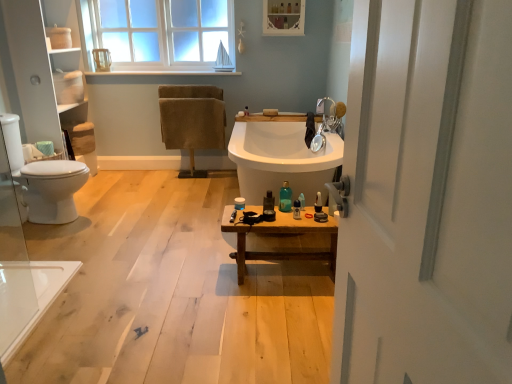
Question: Considering the positions of translucent plastic tube at center, acting as the 2th toiletry starting from the right, and translucent plastic bottle at center, which is the second toiletry from left to right, in the image, is translucent plastic tube at center, acting as the 2th toiletry starting from the right, taller or shorter than translucent plastic bottle at center, which is the second toiletry from left to right,?

Choices:
 (A) tall
 (B) short

Answer: (B)

Question: Looking at their shapes, would you say translucent plastic tube at center, acting as the 2th toiletry starting from the right, is wider or thinner than translucent plastic bottle at center, which is the second toiletry from left to right?

Choices:
 (A) thin
 (B) wide

Answer: (A)

Question: Which of these objects is positioned farthest from the silver metallic faucet at upper center?

Choices:
 (A) wooden bench at center
 (B) translucent plastic bottle at center, marked as the 4th toiletry in a left-to-right arrangement
 (C) translucent glass bottle at center, which is the fourth toiletry from right to left
 (D) white glass window at upper center
 (E) translucent plastic bottle at center, which is the second toiletry from left to right

Answer: (D)

Question: Which of these objects is positioned farthest from the white glossy toilet at left?

Choices:
 (A) matte white container at center, which appears as the first toiletry when viewed from the left
 (B) translucent glass bottle at center, which is the fourth toiletry from right to left
 (C) white glass window at upper center
 (D) silver metallic faucet at upper center
 (E) white matte toilet paper at left

Answer: (D)